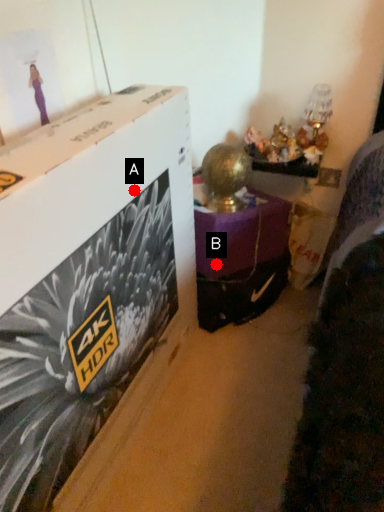
Question: Two points are circled on the image, labeled by A and B beside each circle. Among these points, which one is nearest to the camera?

Choices:
 (A) A is closer
 (B) B is closer

Answer: (A)